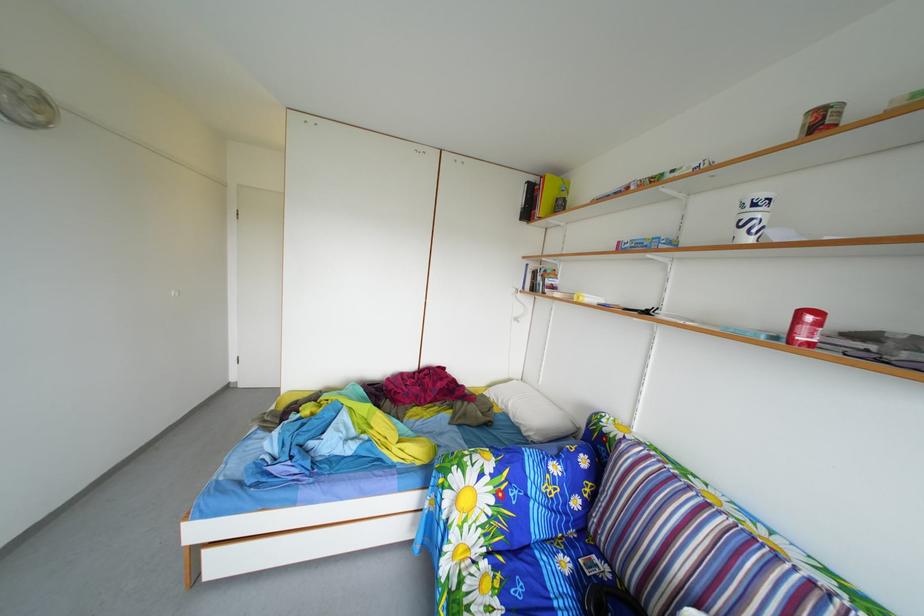
Image resolution: width=924 pixels, height=616 pixels. I want to click on sofa armrest, so (516, 482).